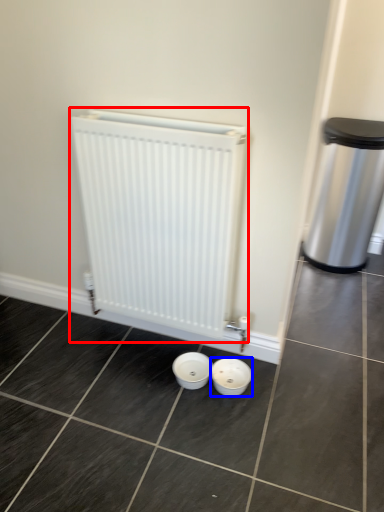
Question: Among these objects, which one is farthest to the camera, radiator (highlighted by a red box) or basin (highlighted by a blue box)?

Choices:
 (A) radiator
 (B) basin

Answer: (B)